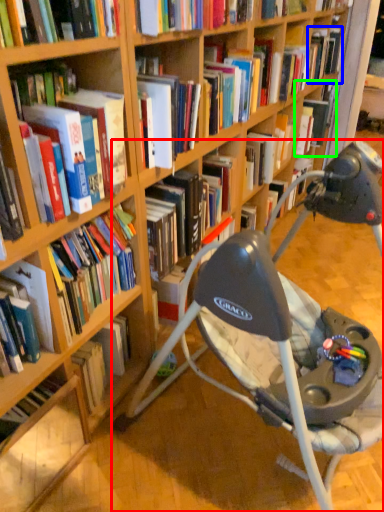
Question: Which object is positioned closest to chair (highlighted by a red box)? Select from book (highlighted by a blue box) and book (highlighted by a green box).

Choices:
 (A) book
 (B) book

Answer: (B)